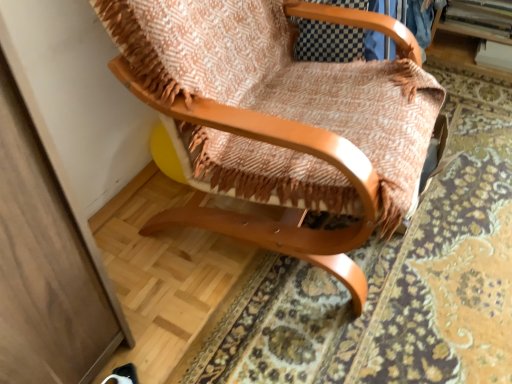
The height and width of the screenshot is (384, 512). Identify the location of woven fabric mat at center. (397, 279).

What do you see at coordinates (397, 279) in the screenshot?
I see `woven fabric mat at center` at bounding box center [397, 279].

The height and width of the screenshot is (384, 512). What do you see at coordinates (280, 119) in the screenshot?
I see `wooden chair at center` at bounding box center [280, 119].

At what (x,y) coordinates should I click in order to perform the action: click on wooden chair at center. Please return your answer as a coordinate pair (x, y). The height and width of the screenshot is (384, 512). Looking at the image, I should click on (x=280, y=119).

Image resolution: width=512 pixels, height=384 pixels. Find the location of `woven fabric mat at center`. woven fabric mat at center is located at coordinates (397, 279).

Does wooden chair at center appear on the right side of woven fabric mat at center?

No.

Consider the image. Relative to woven fabric mat at center, is wooden chair at center in front or behind?

wooden chair at center is in front of woven fabric mat at center.

Does point (269, 87) lie in front of point (442, 183)?

Yes, point (269, 87) is closer to viewer.

From the image's perspective, which one is positioned lower, wooden chair at center or woven fabric mat at center?

From the image's view, woven fabric mat at center is below.

From a real-world perspective, is wooden chair at center positioned over woven fabric mat at center based on gravity?

Yes, from a real-world perspective, wooden chair at center is above woven fabric mat at center.

Which object is thinner, wooden chair at center or woven fabric mat at center?

wooden chair at center is thinner.

In the scene shown: Considering the relative sizes of wooden chair at center and woven fabric mat at center in the image provided, is wooden chair at center shorter than woven fabric mat at center?

Incorrect, the height of wooden chair at center does not fall short of that of woven fabric mat at center.

Who is bigger, wooden chair at center or woven fabric mat at center?

With larger size is wooden chair at center.

Is wooden chair at center not inside woven fabric mat at center?

Yes.

Is the surface of wooden chair at center in direct contact with woven fabric mat at center?

There is a gap between wooden chair at center and woven fabric mat at center.

Is wooden chair at center oriented away from woven fabric mat at center?

No, wooden chair at center is not facing away from woven fabric mat at center.

Identify the location of chair above the woven fabric mat at center (from the image's perspective). (280, 119).

Considering the positions of objects woven fabric mat at center and wooden chair at center in the image provided, who is more to the right, woven fabric mat at center or wooden chair at center?

woven fabric mat at center is more to the right.

Relative to wooden chair at center, is woven fabric mat at center in front or behind?

In the image, woven fabric mat at center appears behind wooden chair at center.

Which is nearer, (465, 328) or (146, 79)?

The point (146, 79) is closer to the camera.

From the image's perspective, which object appears higher, woven fabric mat at center or wooden chair at center?

wooden chair at center is shown above in the image.

From a real-world perspective, is woven fabric mat at center on wooden chair at center?

No.

Which of these two, woven fabric mat at center or wooden chair at center, is wider?

woven fabric mat at center is wider.

Considering the relative sizes of woven fabric mat at center and wooden chair at center in the image provided, is woven fabric mat at center shorter than wooden chair at center?

Yes.

Consider the image. Considering the sizes of woven fabric mat at center and wooden chair at center in the image, is woven fabric mat at center bigger or smaller than wooden chair at center?

In the image, woven fabric mat at center appears to be smaller than wooden chair at center.

Is woven fabric mat at center situated inside wooden chair at center or outside?

woven fabric mat at center is not enclosed by wooden chair at center.

Is woven fabric mat at center next to wooden chair at center and touching it?

No, woven fabric mat at center is not touching wooden chair at center.

Is woven fabric mat at center facing away from wooden chair at center?

No, woven fabric mat at center is not facing the opposite direction of wooden chair at center.

What's the angular difference between woven fabric mat at center and wooden chair at center's facing directions?

The facing directions of woven fabric mat at center and wooden chair at center are 96 degrees apart.

Based on the photo, measure the distance from woven fabric mat at center to wooden chair at center.

The distance of woven fabric mat at center from wooden chair at center is 14.41 inches.

Image resolution: width=512 pixels, height=384 pixels. What are the coordinates of `mat that appears on the right of wooden chair at center` in the screenshot? It's located at (397, 279).

I want to click on chair lying on the left of woven fabric mat at center, so click(x=280, y=119).

Where is `mat below the wooden chair at center (from a real-world perspective)`? The width and height of the screenshot is (512, 384). mat below the wooden chair at center (from a real-world perspective) is located at coordinates tap(397, 279).